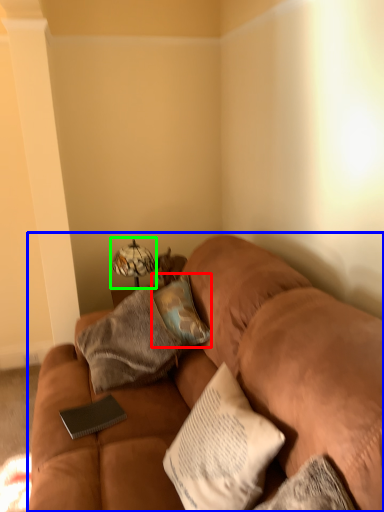
Question: Which is nearer to the pillow (highlighted by a red box)? studio couch (highlighted by a blue box) or table lamp (highlighted by a green box).

Choices:
 (A) studio couch
 (B) table lamp

Answer: (A)